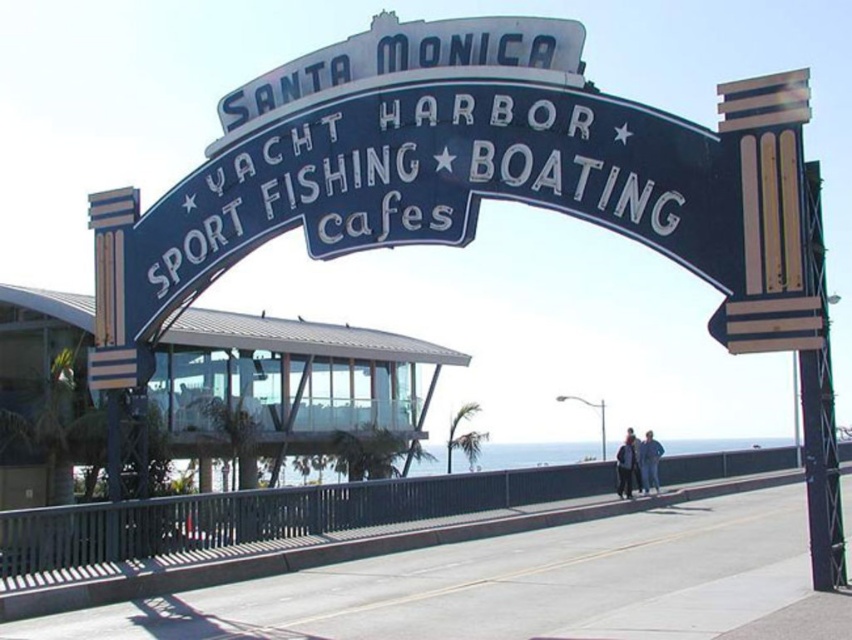
Question: Is dark blue jacket at center below blue denim jacket at lower center?

Choices:
 (A) no
 (B) yes

Answer: (A)

Question: Can you confirm if light blue denim jacket at lower right is positioned to the right of blue denim jacket at lower center?

Choices:
 (A) yes
 (B) no

Answer: (A)

Question: Among these points, which one is farthest from the camera?

Choices:
 (A) (643, 460)
 (B) (637, 458)
 (C) (626, 476)

Answer: (A)

Question: Which object is the farthest from the light blue denim jacket at lower right?

Choices:
 (A) blue denim jacket at lower center
 (B) dark blue jacket at center

Answer: (B)

Question: Is light blue denim jacket at lower right positioned in front of dark blue jacket at center?

Choices:
 (A) yes
 (B) no

Answer: (B)

Question: Which point is closer to the camera?

Choices:
 (A) blue denim jacket at lower center
 (B) dark blue jacket at center

Answer: (B)